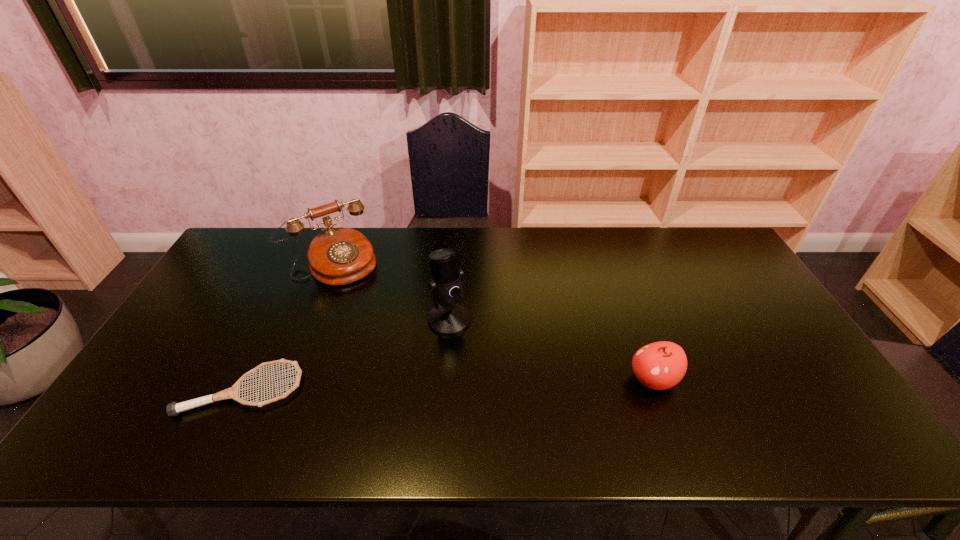
In the image, there is a desktop. Identify the location of vacant space at the far edge. (386, 236).

Image resolution: width=960 pixels, height=540 pixels. In the image, there is a desktop. Find the location of `blank space at the near edge`. blank space at the near edge is located at coordinates (433, 393).

Find the location of a particular element. This screenshot has width=960, height=540. vacant space at the left edge is located at coordinates (205, 364).

You are a GUI agent. You are given a task and a screenshot of the screen. Output one action in this format:
    pyautogui.click(x=<x>, y=<y>)
    Task: Click on the blank area at the right edge
    Image resolution: width=960 pixels, height=540 pixels.
    Given the screenshot: What is the action you would take?
    pyautogui.click(x=738, y=324)

Locate an element on the screen. vacant space at the far left corner of the desktop is located at coordinates (239, 265).

Locate an element on the screen. This screenshot has width=960, height=540. blank space at the far right corner is located at coordinates (725, 248).

Locate an element on the screen. free space between the rightmost object and the second tallest object is located at coordinates (492, 321).

Find the location of `blank region between the tennis racket and the third tallest object`. blank region between the tennis racket and the third tallest object is located at coordinates (447, 384).

I want to click on vacant space that is in between the rightmost object and the tennis racket, so click(x=447, y=384).

This screenshot has height=540, width=960. Find the location of `unoccupied area between the tennis racket and the third object from left to right`. unoccupied area between the tennis racket and the third object from left to right is located at coordinates (346, 355).